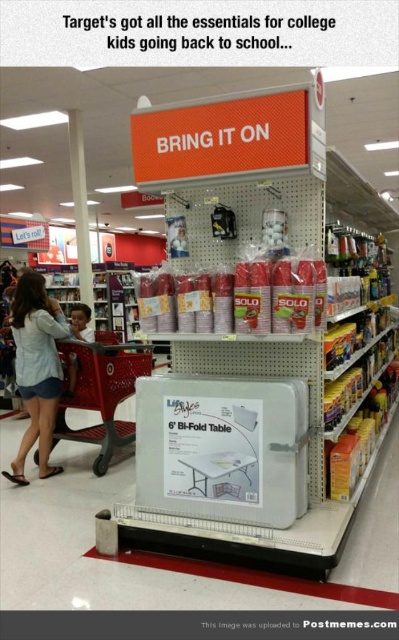
Question: Based on their relative distances, which object is farther from the plastic shopping cart at lower left?

Choices:
 (A) brown leather jacket at lower left
 (B) denim shorts at lower left

Answer: (A)

Question: Which object is closer to the camera taking this photo?

Choices:
 (A) brown leather jacket at lower left
 (B) denim shorts at lower left
 (C) plastic shopping cart at lower left

Answer: (B)

Question: Does plastic shopping cart at lower left lie behind brown leather jacket at lower left?

Choices:
 (A) no
 (B) yes

Answer: (A)

Question: Is denim shorts at lower left thinner than plastic shopping cart at lower left?

Choices:
 (A) yes
 (B) no

Answer: (A)

Question: Which point is farther to the camera?

Choices:
 (A) plastic shopping cart at lower left
 (B) brown leather jacket at lower left

Answer: (B)

Question: From the image, what is the correct spatial relationship of plastic shopping cart at lower left in relation to brown leather jacket at lower left?

Choices:
 (A) below
 (B) above

Answer: (A)